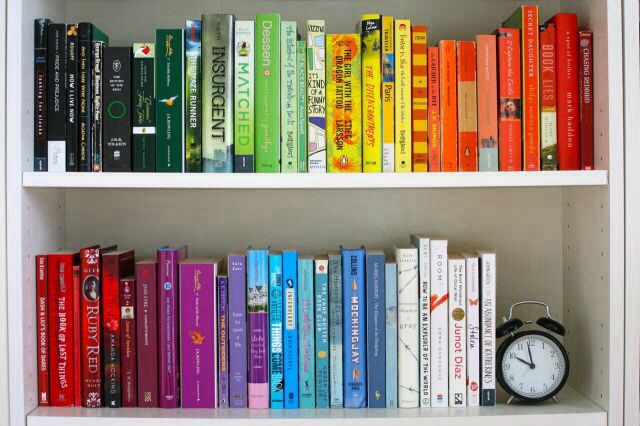
Where is `orange books`? orange books is located at coordinates (432, 94), (450, 103), (465, 108), (491, 109), (506, 88), (529, 81), (545, 84), (563, 89).